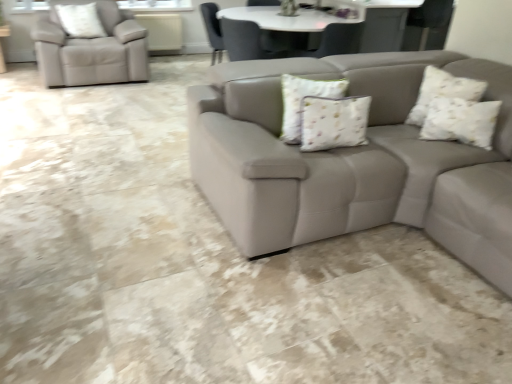
Question: Are white textured pillow at upper right, which is the 3th pillow in left-to-right order, and white textured pillow at upper left, which appears as the third pillow when viewed from the front, beside each other?

Choices:
 (A) no
 (B) yes

Answer: (A)

Question: From the image's perspective, is white textured pillow at upper right, acting as the 2th pillow starting from the front, on top of white textured pillow at upper left, which ranks as the first pillow in top-to-bottom order?

Choices:
 (A) no
 (B) yes

Answer: (A)

Question: From a real-world perspective, is white textured pillow at upper right, which appears as the second pillow when viewed from the top, beneath white textured pillow at upper left, which appears as the third pillow when viewed from the front?

Choices:
 (A) yes
 (B) no

Answer: (A)

Question: Does white textured pillow at upper right, which is the first pillow from right to left, have a lesser width compared to white textured pillow at upper left, which appears as the third pillow when viewed from the front?

Choices:
 (A) yes
 (B) no

Answer: (B)

Question: Is white textured pillow at upper right, acting as the 2th pillow starting from the front, outside white textured pillow at upper left, placed as the 3th pillow when sorted from right to left?

Choices:
 (A) no
 (B) yes

Answer: (B)

Question: Is white textured pillow at upper right, which is the first pillow from right to left, far from white textured pillow at upper left, the 3th pillow ordered from the bottom?

Choices:
 (A) yes
 (B) no

Answer: (A)

Question: From the image's perspective, is white floral fabric pillow at center, positioned as the 3th pillow in top-to-bottom order, located above white textured pillow at upper left, the 3th pillow ordered from the bottom?

Choices:
 (A) yes
 (B) no

Answer: (B)

Question: Is white floral fabric pillow at center, positioned as the 3th pillow in top-to-bottom order, to the right of white textured pillow at upper left, which ranks as the first pillow in top-to-bottom order, from the viewer's perspective?

Choices:
 (A) no
 (B) yes

Answer: (B)

Question: Is white floral fabric pillow at center, which is the 3th pillow from back to front, further to the viewer compared to white textured pillow at upper left, marked as the first pillow in a left-to-right arrangement?

Choices:
 (A) yes
 (B) no

Answer: (B)

Question: Is white floral fabric pillow at center, positioned as the 3th pillow in top-to-bottom order, oriented away from white textured pillow at upper left, marked as the first pillow in a left-to-right arrangement?

Choices:
 (A) yes
 (B) no

Answer: (A)

Question: From a real-world perspective, is white floral fabric pillow at center, positioned as the 3th pillow in top-to-bottom order, physically above white textured pillow at upper left, marked as the first pillow in a left-to-right arrangement?

Choices:
 (A) yes
 (B) no

Answer: (B)

Question: From the image's perspective, is white floral fabric pillow at center, positioned as the 3th pillow in top-to-bottom order, beneath white textured pillow at upper left, which ranks as the first pillow in top-to-bottom order?

Choices:
 (A) no
 (B) yes

Answer: (B)

Question: Considering the relative positions of white textured pillow at upper left, the 3th pillow ordered from the bottom, and white textured pillow at upper right, which is the 3th pillow in left-to-right order, in the image provided, is white textured pillow at upper left, the 3th pillow ordered from the bottom, to the left of white textured pillow at upper right, which is the 3th pillow in left-to-right order, from the viewer's perspective?

Choices:
 (A) yes
 (B) no

Answer: (A)